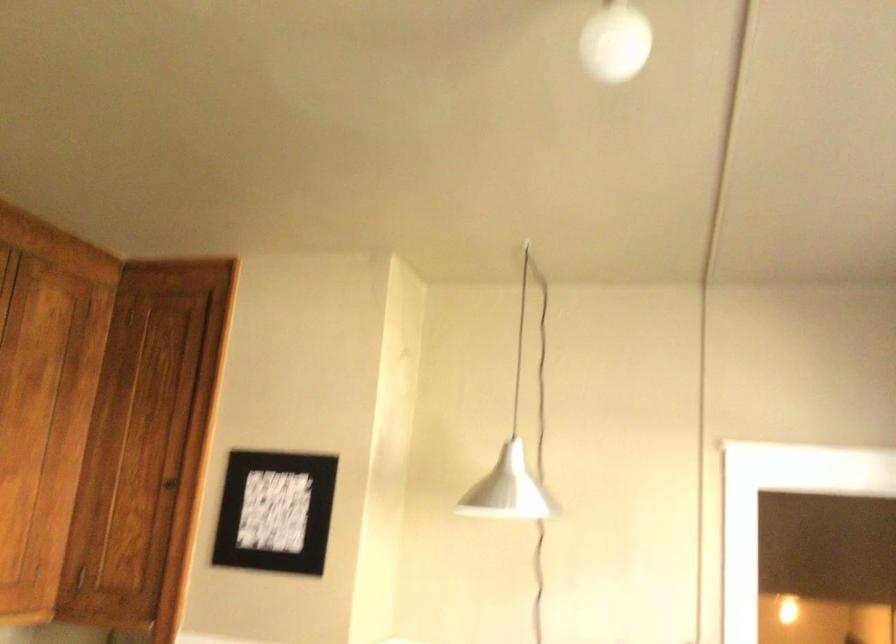
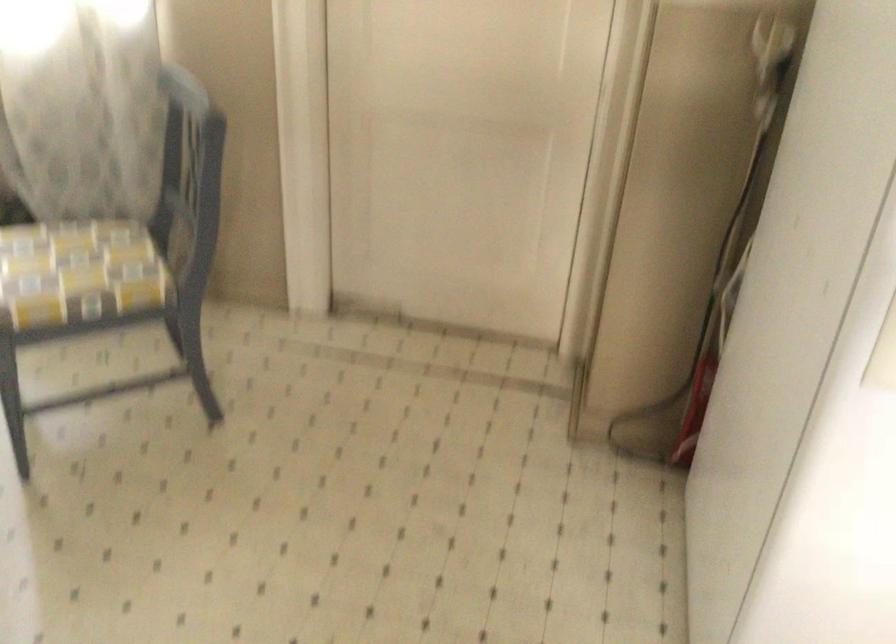
The first image is from the beginning of the video and the second image is from the end. How did the camera likely rotate when shooting the video?

The rotation direction of the camera is left-down.